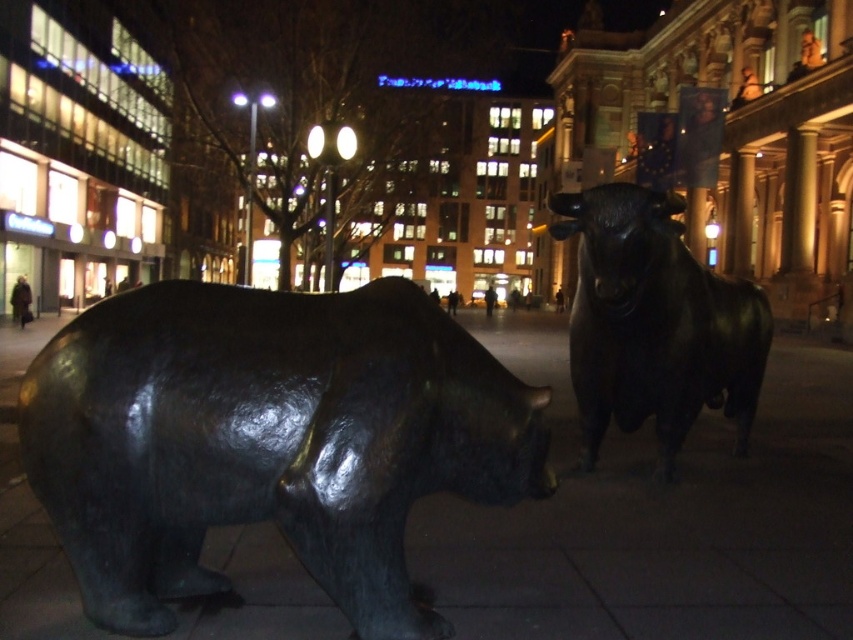
Question: Which point is closer to the camera?

Choices:
 (A) shiny black bull at center
 (B) shiny bronze bear at left

Answer: (B)

Question: Which of the following is the closest to the observer?

Choices:
 (A) [650, 333]
 (B) [392, 588]

Answer: (B)

Question: From the image, what is the correct spatial relationship of shiny bronze bear at left in relation to shiny black bull at center?

Choices:
 (A) left
 (B) right

Answer: (A)

Question: Does shiny bronze bear at left come in front of shiny black bull at center?

Choices:
 (A) yes
 (B) no

Answer: (A)

Question: In this image, where is shiny bronze bear at left located relative to shiny black bull at center?

Choices:
 (A) below
 (B) above

Answer: (A)